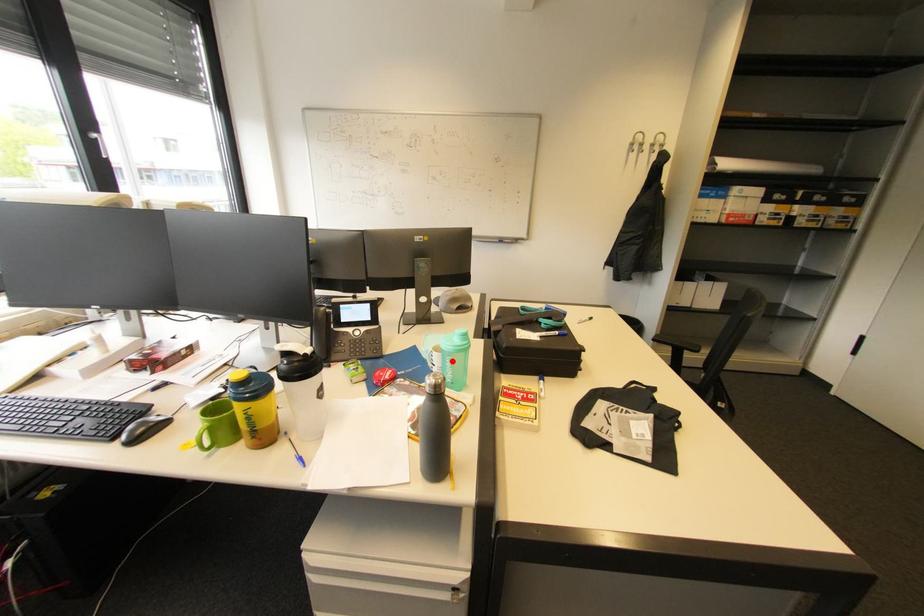
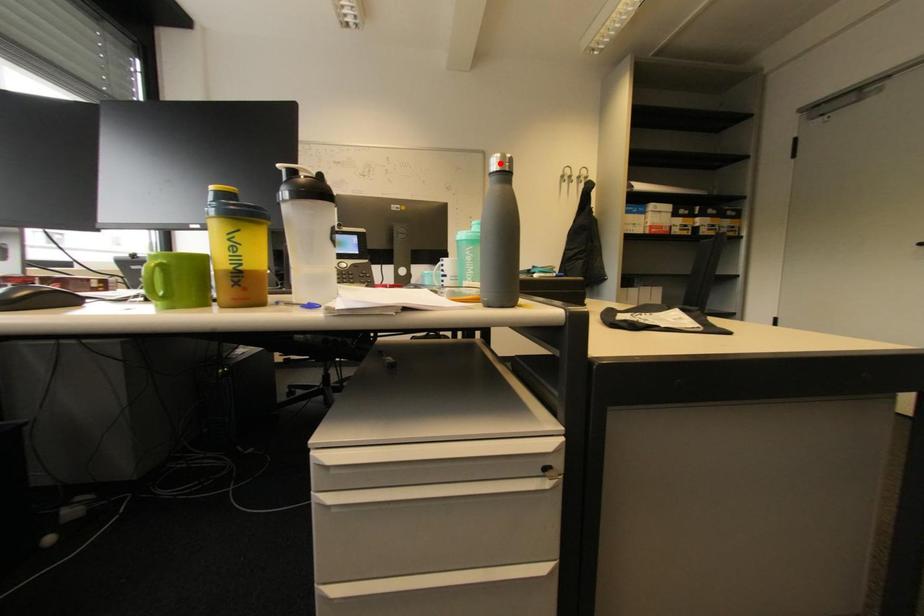
I am providing you with two images of the same scene from different viewpoints. A red point is marked on the first image and another point is marked on the second image. Do the highlighted points in image1 and image2 indicate the same real-world spot?

No